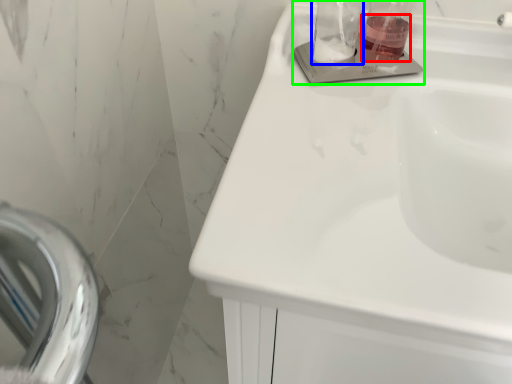
Question: Based on their relative distances, which object is nearer to liquid (highlighted by a red box)? Choose from glass jar (highlighted by a blue box) and sink (highlighted by a green box).

Choices:
 (A) glass jar
 (B) sink

Answer: (B)